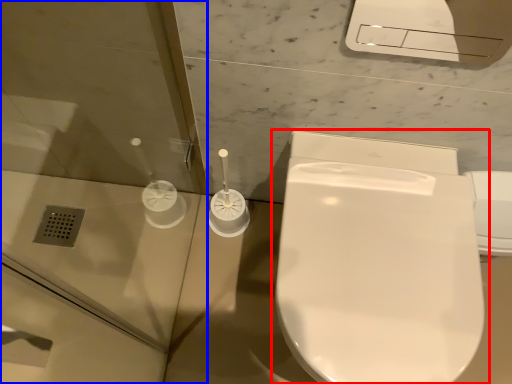
Question: Which point is further to the camera, toilet (highlighted by a red box) or screen door (highlighted by a blue box)?

Choices:
 (A) toilet
 (B) screen door

Answer: (A)